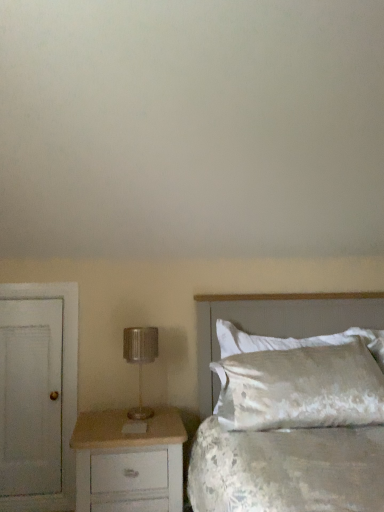
Question: In the image, is white painted wood chest of drawers at lower left positioned in front of or behind satin white bed at right?

Choices:
 (A) behind
 (B) front

Answer: (A)

Question: From a real-world perspective, relative to satin white bed at right, is white painted wood chest of drawers at lower left vertically above or below?

Choices:
 (A) above
 (B) below

Answer: (B)

Question: Which is nearer to the satin white pillow at right?

Choices:
 (A) metallic silver lamp at left
 (B) white painted wood chest of drawers at lower left
 (C) white matte door at left
 (D) satin white bed at right

Answer: (D)

Question: Based on their relative distances, which object is farther from the white matte door at left?

Choices:
 (A) satin white bed at right
 (B) white painted wood chest of drawers at lower left
 (C) satin white pillow at right
 (D) metallic silver lamp at left

Answer: (C)